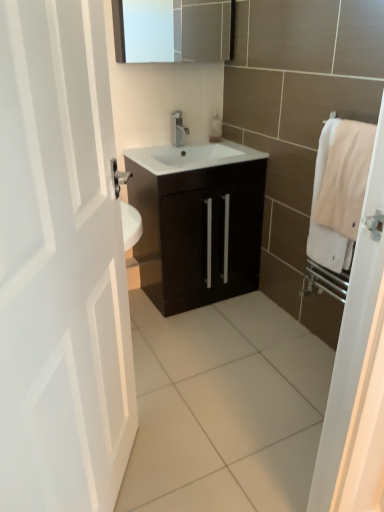
Where is `vacant region in front of satin nickel faucet at center`? Image resolution: width=384 pixels, height=512 pixels. vacant region in front of satin nickel faucet at center is located at coordinates (182, 150).